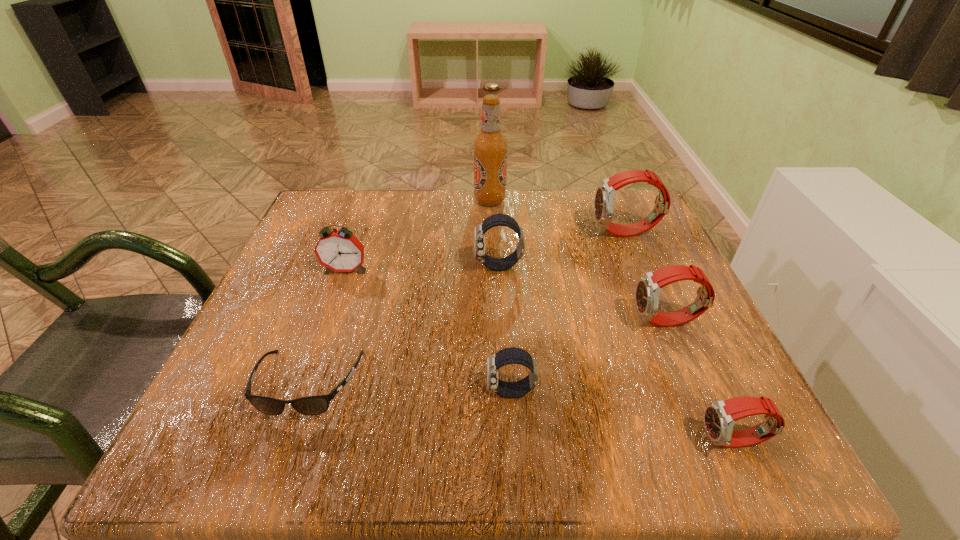
Locate an element on the screen. The height and width of the screenshot is (540, 960). vacant area that lies between the second smallest red watch and the nearest watch is located at coordinates (701, 382).

The height and width of the screenshot is (540, 960). I want to click on vacant area that lies between the nearest watch and the shortest object, so click(521, 413).

Where is `vacant area between the second farthest watch and the beer bottle`? The image size is (960, 540). vacant area between the second farthest watch and the beer bottle is located at coordinates (493, 233).

You are a GUI agent. You are given a task and a screenshot of the screen. Output one action in this format:
    pyautogui.click(x=<x>, y=<y>)
    Task: Click on the free area in between the alarm clock and the second tallest object
    The width and height of the screenshot is (960, 540).
    Given the screenshot: What is the action you would take?
    pyautogui.click(x=486, y=252)

At what (x,y) coordinates should I click in order to perform the action: click on free space that is in between the gray sunglasses and the tallest object. Please return your answer as a coordinate pair (x, y). Image resolution: width=960 pixels, height=540 pixels. Looking at the image, I should click on (399, 293).

I want to click on vacant area between the gray sunglasses and the beer bottle, so click(399, 293).

Find the location of `vacant area that lies between the smaller dark watch and the alarm clock`. vacant area that lies between the smaller dark watch and the alarm clock is located at coordinates (428, 331).

Identify the location of blank region between the alarm clock and the second farthest watch. (421, 268).

Find the location of a particular element. the fifth closest object to the farthest object is located at coordinates (312, 405).

Identify which object is located as the fourth nearest to the sunglasses. Please provide its 2D coordinates. Your answer should be formatted as a tuple, i.e. [(x, y)], where the tuple contains the x and y coordinates of a point satisfying the conditions above.

[(648, 288)]